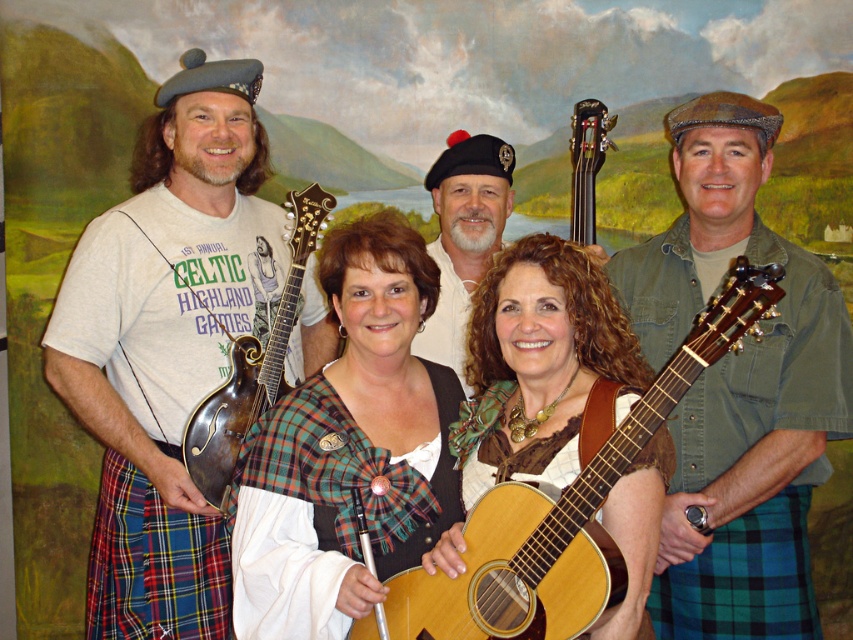
Can you confirm if plaid fabric vest at center is positioned below polished dark wood guitar at upper center?

Indeed, plaid fabric vest at center is positioned under polished dark wood guitar at upper center.

Which is below, plaid fabric vest at center or polished dark wood guitar at upper center?

Positioned lower is plaid fabric vest at center.

Where is `plaid fabric vest at center`? The height and width of the screenshot is (640, 853). plaid fabric vest at center is located at coordinates coord(347,448).

You are a GUI agent. You are given a task and a screenshot of the screen. Output one action in this format:
    pyautogui.click(x=<x>, y=<y>)
    Task: Click on the plaid fabric vest at center
    Image resolution: width=853 pixels, height=640 pixels.
    Given the screenshot: What is the action you would take?
    pyautogui.click(x=347, y=448)

Is point (746, 444) less distant than point (560, 611)?

No, (746, 444) is further to viewer.

Where is `green denim shirt at center`? The image size is (853, 640). green denim shirt at center is located at coordinates (737, 388).

Image resolution: width=853 pixels, height=640 pixels. In order to click on green denim shirt at center in this screenshot , I will do `click(737, 388)`.

Does green denim shirt at center have a larger size compared to wooden mandolin at left?

Indeed, green denim shirt at center has a larger size compared to wooden mandolin at left.

Does green denim shirt at center appear over wooden mandolin at left?

No, green denim shirt at center is not above wooden mandolin at left.

The image size is (853, 640). I want to click on green denim shirt at center, so pos(737,388).